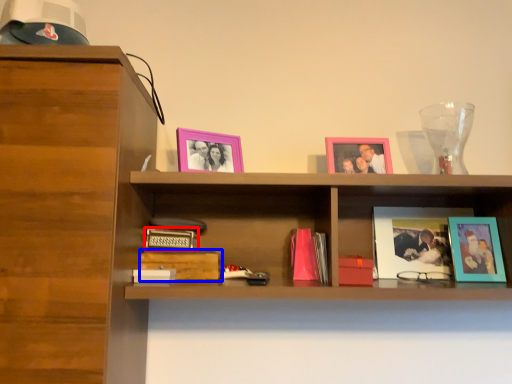
Question: Which of the following is the closest to the observer, paperback book (highlighted by a red box) or paperback book (highlighted by a blue box)?

Choices:
 (A) paperback book
 (B) paperback book

Answer: (B)